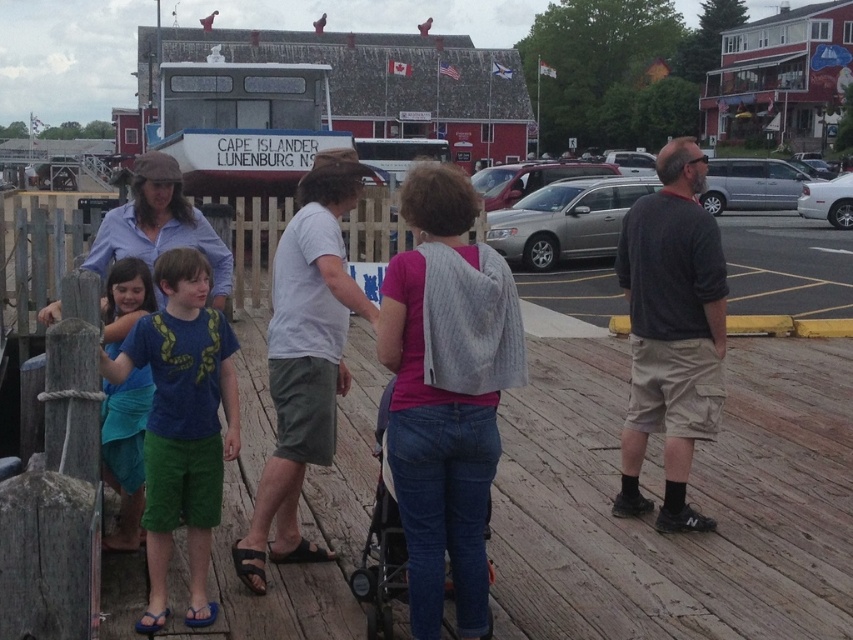
Does dark gray cotton shirt at center appear under blue cotton shirt at left?

No, dark gray cotton shirt at center is not below blue cotton shirt at left.

Locate an element on the screen. This screenshot has width=853, height=640. dark gray cotton shirt at center is located at coordinates (671, 332).

The image size is (853, 640). I want to click on dark gray cotton shirt at center, so click(671, 332).

Between point (160, 518) and point (144, 266), which one is positioned in front?

Positioned in front is point (160, 518).

Between blue cotton shirt at left and blue fabric shirt at left, which one appears on the left side from the viewer's perspective?

blue fabric shirt at left

The image size is (853, 640). What do you see at coordinates (183, 426) in the screenshot?
I see `blue cotton shirt at left` at bounding box center [183, 426].

This screenshot has height=640, width=853. Find the location of `blue cotton shirt at left`. blue cotton shirt at left is located at coordinates (183, 426).

Between blue t-shirt at center and blue cotton shirt at left, which one is positioned higher?

blue t-shirt at center is above.

Between point (395, 435) and point (228, 376), which one is positioned behind?

The point (228, 376) is behind.

Image resolution: width=853 pixels, height=640 pixels. I want to click on blue t-shirt at center, so click(x=442, y=387).